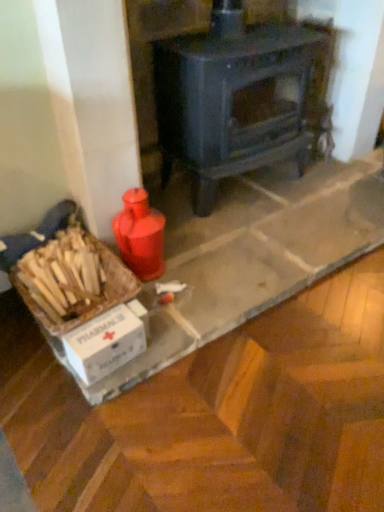
Question: In terms of width, does matte black wood burning stove at center look wider or thinner when compared to white cardboard box at lower left?

Choices:
 (A) thin
 (B) wide

Answer: (B)

Question: Is matte black wood burning stove at center inside the boundaries of white cardboard box at lower left, or outside?

Choices:
 (A) inside
 (B) outside

Answer: (B)

Question: Based on their relative distances, which object is farther from the matte black wood burning stove at center?

Choices:
 (A) white cardboard box at lower left
 (B) white cardboard box at lower left

Answer: (A)

Question: Which of these objects is positioned closest to the white cardboard box at lower left?

Choices:
 (A) white cardboard box at lower left
 (B) matte black wood burning stove at center

Answer: (A)